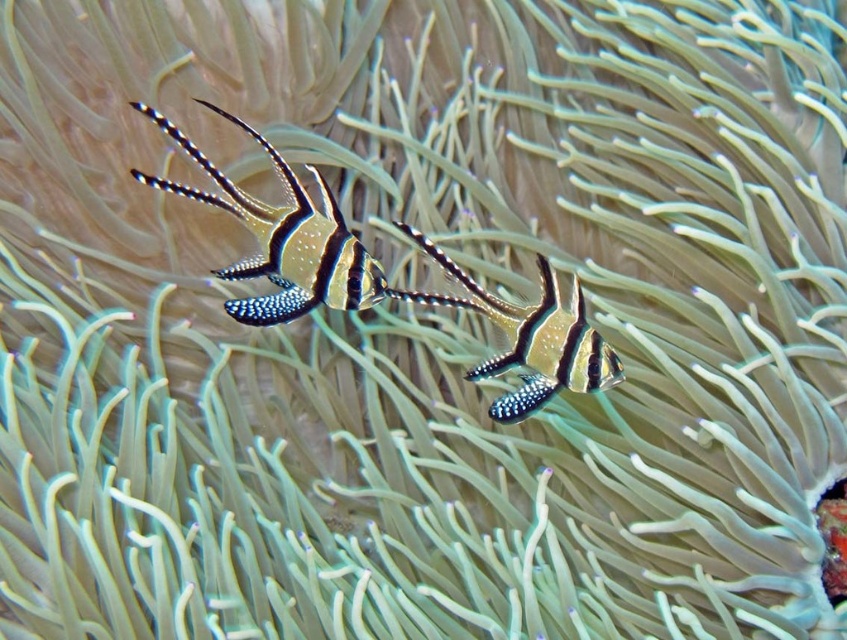
Can you confirm if black and white striped fish at left is positioned above black and white striped fish at center?

Yes.

Between black and white striped fish at left and black and white striped fish at center, which one has more height?

black and white striped fish at left

Is point (299, 246) farther from camera compared to point (616, 360)?

No.

Find the location of a particular element. The image size is (847, 640). black and white striped fish at left is located at coordinates (281, 237).